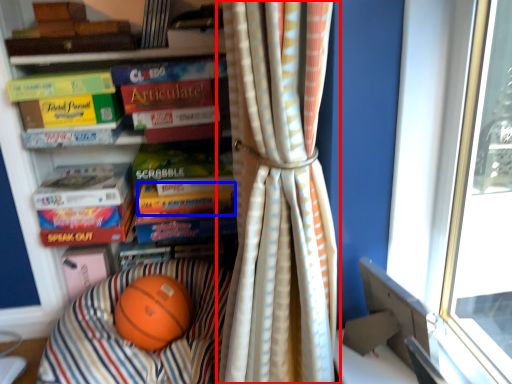
Question: Among these objects, which one is farthest to the camera, curtain (highlighted by a red box) or paperback book (highlighted by a blue box)?

Choices:
 (A) curtain
 (B) paperback book

Answer: (B)